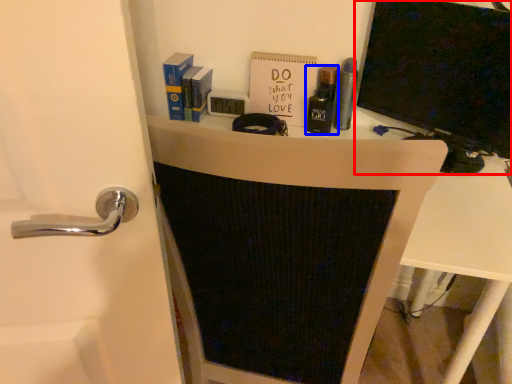
Question: Which point is closer to the camera, wide (highlighted by a red box) or toiletry (highlighted by a blue box)?

Choices:
 (A) wide
 (B) toiletry

Answer: (A)